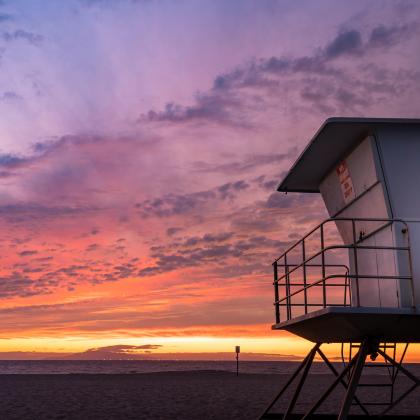
At what (x,y) coordinates should I click in order to perform the action: click on stairs. Please return your answer as a coordinate pair (x, y). Image resolution: width=420 pixels, height=420 pixels. Looking at the image, I should click on tap(370, 386).